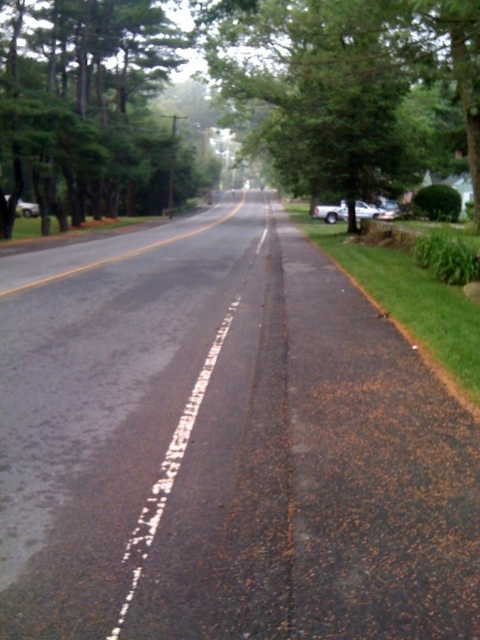
Question: Considering the relative positions of green leafy tree at left and white dashed line at center in the image provided, where is green leafy tree at left located with respect to white dashed line at center?

Choices:
 (A) above
 (B) below

Answer: (A)

Question: Which of the following is the closest to the observer?

Choices:
 (A) green leafy tree at center
 (B) green leafy tree at left

Answer: (A)

Question: Does green leafy tree at left appear on the left side of white dashed line at center?

Choices:
 (A) no
 (B) yes

Answer: (B)

Question: Which point appears closest to the camera in this image?

Choices:
 (A) pos(52,67)
 (B) pos(421,112)
 (C) pos(266,228)

Answer: (B)

Question: Does green leafy tree at center have a greater width compared to green leafy tree at left?

Choices:
 (A) no
 (B) yes

Answer: (B)

Question: Which object is closer to the camera taking this photo?

Choices:
 (A) green leafy tree at center
 (B) white dashed line at center

Answer: (B)